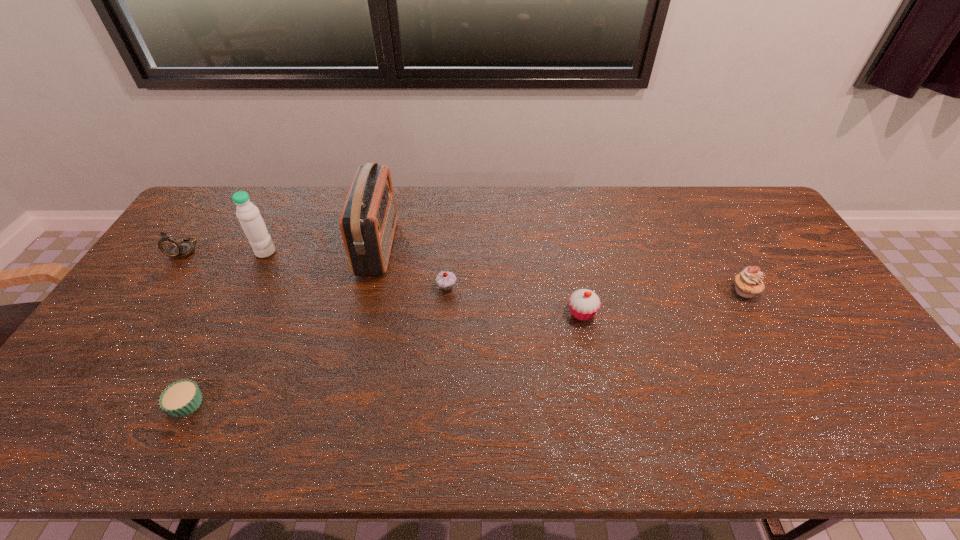
Image resolution: width=960 pixels, height=540 pixels. What are the coordinates of `free space at the right edge of the desktop` in the screenshot? It's located at (812, 279).

At what (x,y) coordinates should I click in order to perform the action: click on vacant point at the far left corner. Please return your answer as a coordinate pair (x, y). The height and width of the screenshot is (540, 960). Looking at the image, I should click on (231, 195).

This screenshot has width=960, height=540. In order to click on vacant space in between the shortest cupcake and the compass in this screenshot , I will do `click(185, 326)`.

The width and height of the screenshot is (960, 540). Identify the location of free space between the compass and the fifth object from left to right. (316, 268).

The height and width of the screenshot is (540, 960). Identify the location of free space between the nearest cupcake and the third object from right to left. (317, 345).

Where is `vacant region between the rightmost object and the sixth object from left to right`? The image size is (960, 540). vacant region between the rightmost object and the sixth object from left to right is located at coordinates (663, 302).

This screenshot has width=960, height=540. Identify the location of empty space that is in between the shortest cupcake and the second cupcake from right to left. (384, 358).

This screenshot has height=540, width=960. I want to click on vacant area that lies between the water bottle and the compass, so click(x=226, y=251).

Identify the location of vacant area between the water bottle and the compass. (226, 251).

Identify the location of vacant point located between the rightmost cupcake and the radio receiver. This screenshot has width=960, height=540. (561, 269).